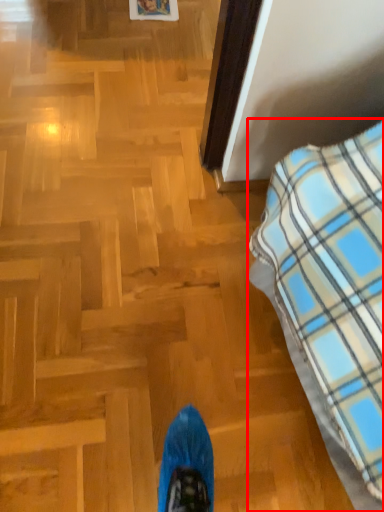
Question: Considering the relative positions of furniture (annotated by the red box) and picture frame in the image provided, where is furniture (annotated by the red box) located with respect to the staircase?

Choices:
 (A) left
 (B) right

Answer: (B)